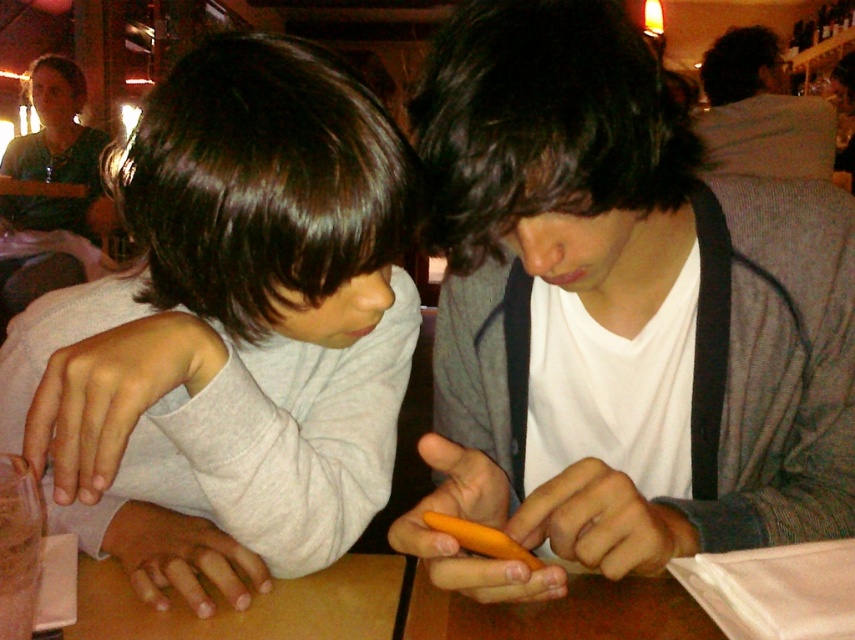
Is point (370, 630) farther from viewer compared to point (467, 541)?

Yes, point (370, 630) is behind point (467, 541).

Does brown wooden table at lower center appear on the right side of orange matte carrot at center?

In fact, brown wooden table at lower center is to the left of orange matte carrot at center.

Is point (351, 634) positioned behind point (517, 561)?

Yes, point (351, 634) is farther from viewer.

Where is `brown wooden table at lower center`? This screenshot has width=855, height=640. brown wooden table at lower center is located at coordinates pos(248,605).

Can you confirm if matte gray sweatshirt at left is wider than brown wooden table at lower center?

Yes, matte gray sweatshirt at left is wider than brown wooden table at lower center.

Who is more distant from viewer, (168, 406) or (375, 630)?

The point (168, 406) is more distant.

Between point (214, 298) and point (119, 616), which one is positioned behind?

Point (119, 616)

In order to click on matte gray sweatshirt at left in this screenshot , I will do `click(230, 330)`.

Is orange matte phone at center bigger than orange matte carrot at center?

Yes.

Is point (575, 376) farther from camera compared to point (428, 522)?

Yes.

Where is `orange matte phone at center`? orange matte phone at center is located at coordinates (617, 312).

This screenshot has height=640, width=855. I want to click on orange matte phone at center, so click(617, 312).